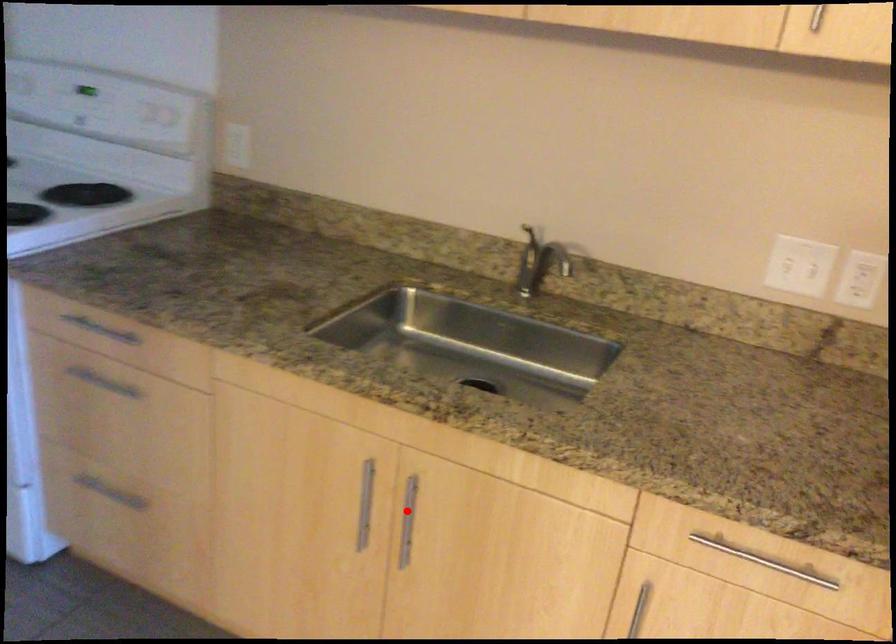
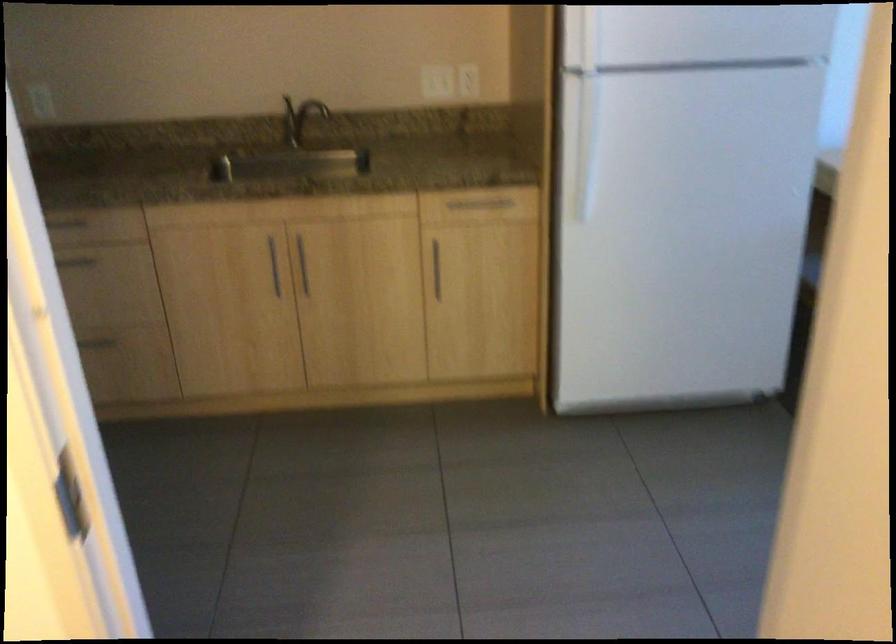
Question: I am providing you with two images of the same scene from different viewpoints. A red point is shown in image1. For the corresponding object point in image2, is it positioned nearer or farther from the camera?

Choices:
 (A) Nearer
 (B) Farther

Answer: (B)